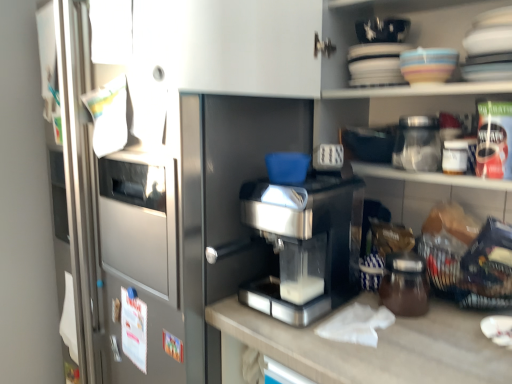
Question: From the image's perspective, is matte ceramic bowl at upper right on sleek metallic coffee machine at center?

Choices:
 (A) no
 (B) yes

Answer: (B)

Question: Can you confirm if matte ceramic bowl at upper right is taller than sleek metallic coffee machine at center?

Choices:
 (A) yes
 (B) no

Answer: (B)

Question: Can you confirm if matte ceramic bowl at upper right is positioned to the left of sleek metallic coffee machine at center?

Choices:
 (A) no
 (B) yes

Answer: (A)

Question: Is matte ceramic bowl at upper right bigger than sleek metallic coffee machine at center?

Choices:
 (A) yes
 (B) no

Answer: (B)

Question: Does matte ceramic bowl at upper right have a smaller size compared to sleek metallic coffee machine at center?

Choices:
 (A) yes
 (B) no

Answer: (A)

Question: From their relative heights in the image, would you say brown glass jar at lower right, which is counted as the 1th glass jar, starting from the bottom, is taller or shorter than sleek metallic coffee machine at center?

Choices:
 (A) tall
 (B) short

Answer: (B)

Question: Based on their positions, is brown glass jar at lower right, which is counted as the 1th glass jar, starting from the bottom, located to the left or right of sleek metallic coffee machine at center?

Choices:
 (A) right
 (B) left

Answer: (A)

Question: From a real-world perspective, is brown glass jar at lower right, the second glass jar when ordered from top to bottom, positioned above or below sleek metallic coffee machine at center?

Choices:
 (A) below
 (B) above

Answer: (A)

Question: From the image's perspective, is brown glass jar at lower right, the second glass jar when ordered from top to bottom, above or below sleek metallic coffee machine at center?

Choices:
 (A) below
 (B) above

Answer: (A)

Question: Is sleek metallic coffee machine at center bigger or smaller than matte ceramic bowl at upper right?

Choices:
 (A) big
 (B) small

Answer: (A)

Question: Is point (336, 216) closer or farther from the camera than point (418, 77)?

Choices:
 (A) farther
 (B) closer

Answer: (A)

Question: From a real-world perspective, is sleek metallic coffee machine at center above or below matte ceramic bowl at upper right?

Choices:
 (A) below
 (B) above

Answer: (A)

Question: Looking at their shapes, would you say sleek metallic coffee machine at center is wider or thinner than matte ceramic bowl at upper right?

Choices:
 (A) wide
 (B) thin

Answer: (A)

Question: Considering the relative positions of transparent glass jar at upper right, placed as the second glass jar when sorted from bottom to top, and matte ceramic bowl at upper right in the image provided, is transparent glass jar at upper right, placed as the second glass jar when sorted from bottom to top, to the left or to the right of matte ceramic bowl at upper right?

Choices:
 (A) left
 (B) right

Answer: (B)

Question: Would you say transparent glass jar at upper right, placed as the second glass jar when sorted from bottom to top, is inside or outside matte ceramic bowl at upper right?

Choices:
 (A) outside
 (B) inside

Answer: (A)